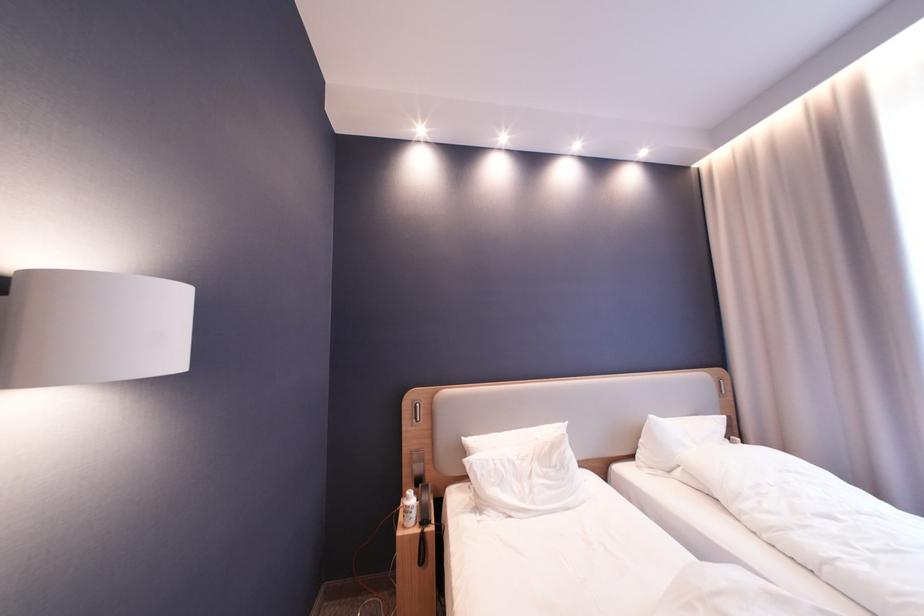
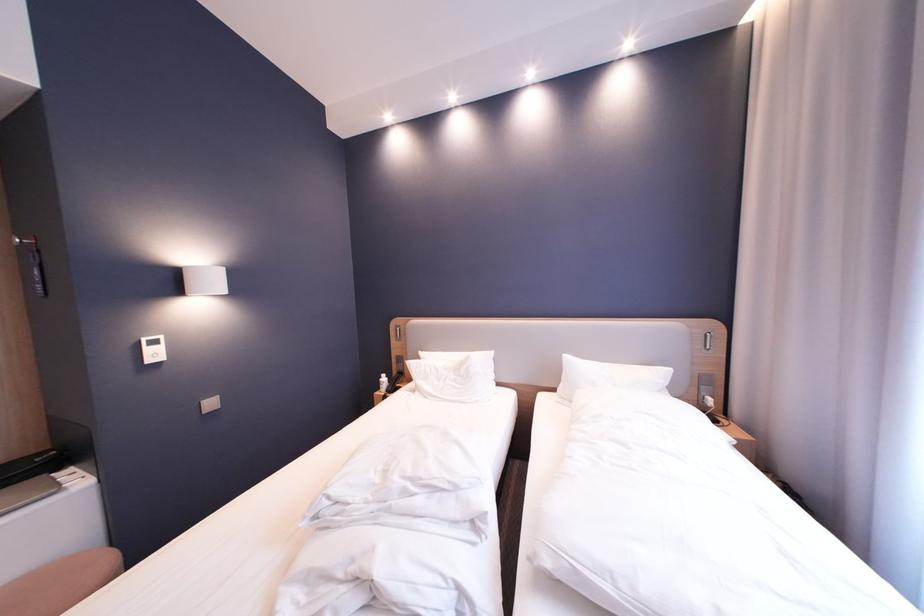
Locate, in the second image, the point that corresponds to (530,483) in the first image.

(450, 382)